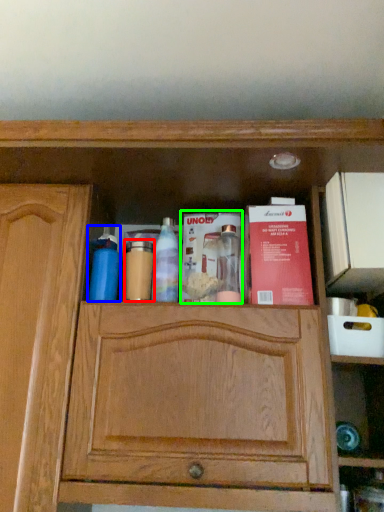
Question: Based on their relative distances, which object is nearer to toiletry (highlighted by a red box)? Choose from cleaning product (highlighted by a blue box) and book (highlighted by a green box).

Choices:
 (A) cleaning product
 (B) book

Answer: (A)